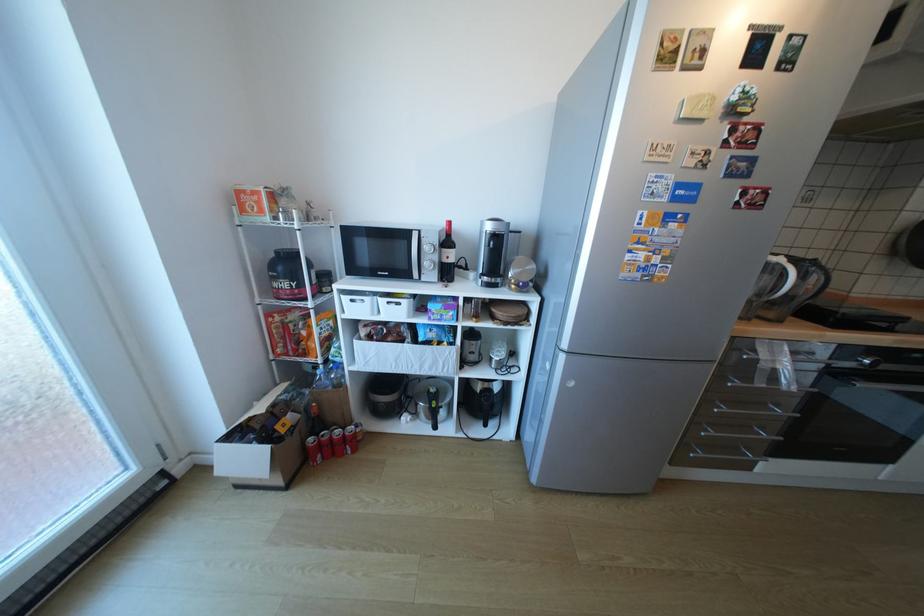
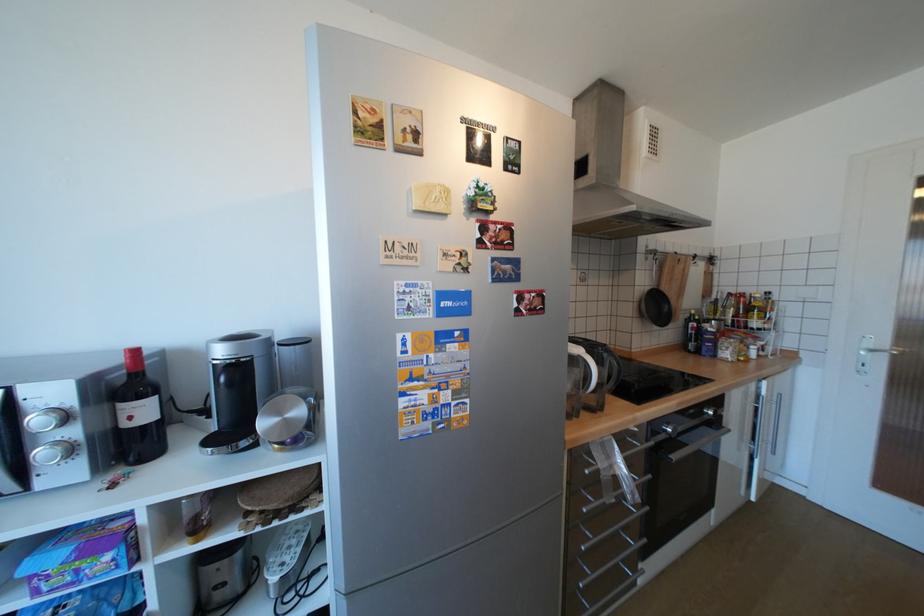
Question: How did the camera likely rotate?

Choices:
 (A) Left
 (B) Right
 (C) Up
 (D) Down

Answer: (B)